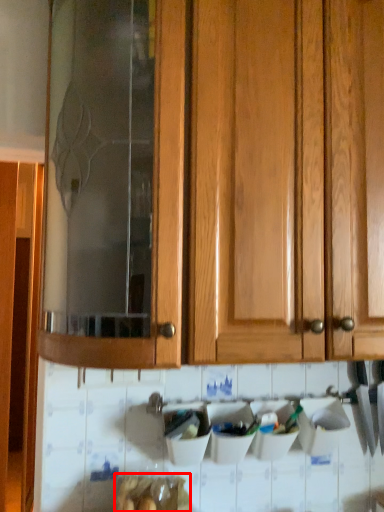
Question: Considering the relative positions of food (annotated by the red box) and cabinetry in the image provided, where is food (annotated by the red box) located with respect to the staircase?

Choices:
 (A) left
 (B) right

Answer: (A)